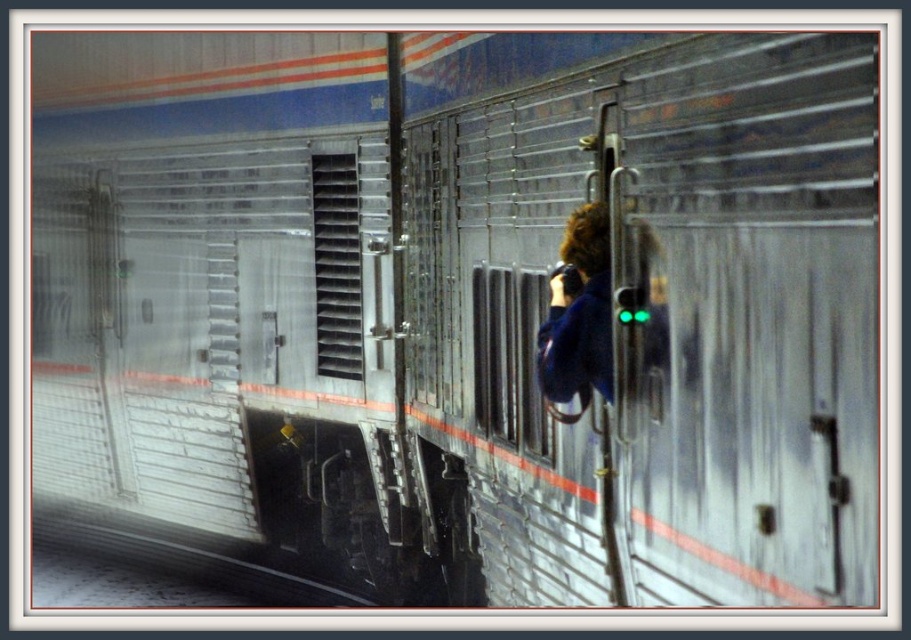
Question: Does gray concrete train track at lower left appear over blue fabric jacket at center?

Choices:
 (A) no
 (B) yes

Answer: (A)

Question: Is gray concrete train track at lower left closer to the viewer compared to blue fabric jacket at center?

Choices:
 (A) yes
 (B) no

Answer: (B)

Question: Which point is closer to the camera taking this photo?

Choices:
 (A) (566, 264)
 (B) (320, 584)

Answer: (A)

Question: Is gray concrete train track at lower left closer to camera compared to blue fabric jacket at center?

Choices:
 (A) yes
 (B) no

Answer: (B)

Question: Which of the following is the farthest from the observer?

Choices:
 (A) gray concrete train track at lower left
 (B) blue fabric jacket at center

Answer: (A)